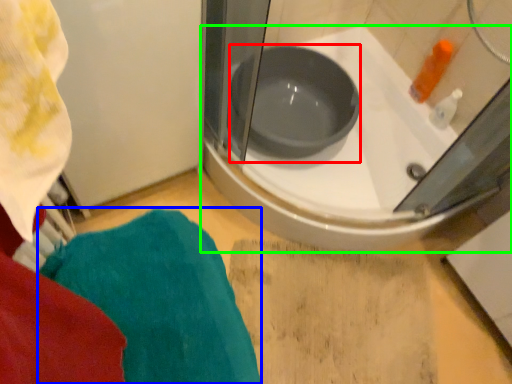
Question: Which object is the closest to the basin (highlighted by a red box)? Choose among these: bath towel (highlighted by a blue box) or bathtub (highlighted by a green box).

Choices:
 (A) bath towel
 (B) bathtub

Answer: (B)